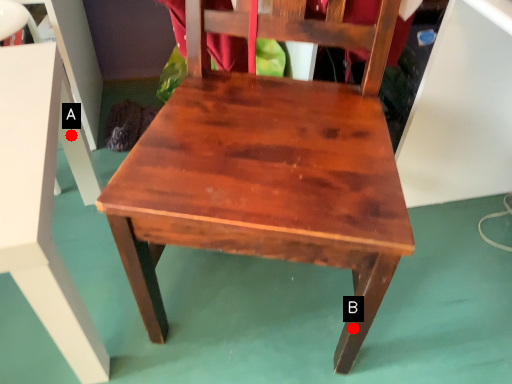
Question: Two points are circled on the image, labeled by A and B beside each circle. Which point appears farthest from the camera in this image?

Choices:
 (A) A is further
 (B) B is further

Answer: (A)